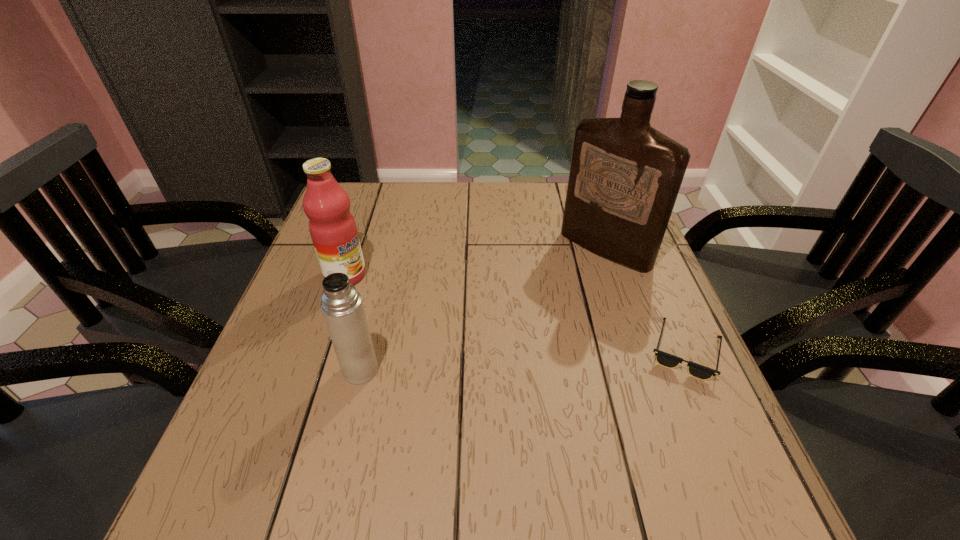
The width and height of the screenshot is (960, 540). I want to click on free space between the fruit juice and the liquor, so [475, 262].

The image size is (960, 540). In order to click on empty space that is in between the third shortest object and the tallest object in this screenshot , I will do `click(475, 262)`.

Locate an element on the screen. The height and width of the screenshot is (540, 960). object that can be found as the closest to the thermos bottle is located at coordinates (332, 227).

Locate an element on the screen. The image size is (960, 540). object that ranks as the third closest to the second tallest object is located at coordinates (665, 359).

Find the location of a particular element. The height and width of the screenshot is (540, 960). vacant region that satisfies the following two spatial constraints: 1. on the back side of the thermos bottle; 2. on the right side of the liquor is located at coordinates (390, 249).